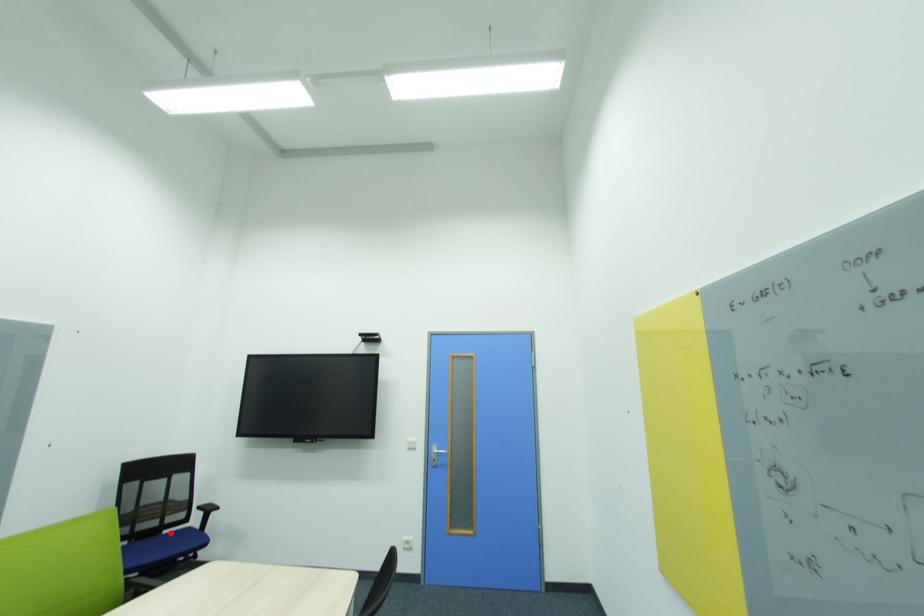
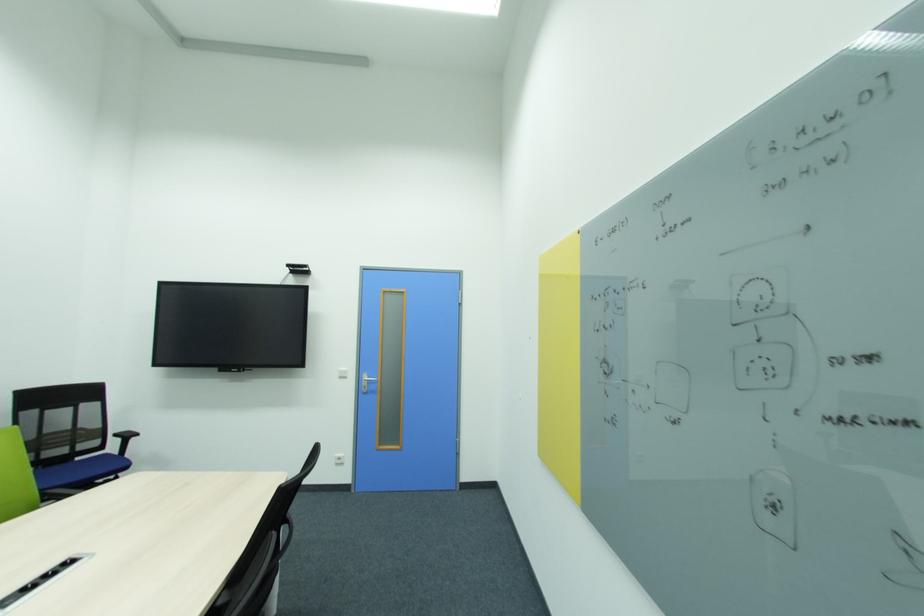
Question: A red point is marked in image1. In image2, is the corresponding 3D point closer to the camera or farther? Reply with the corresponding letter.

Choices:
 (A) The corresponding 3D point is closer.
 (B) The corresponding 3D point is farther.

Answer: (B)